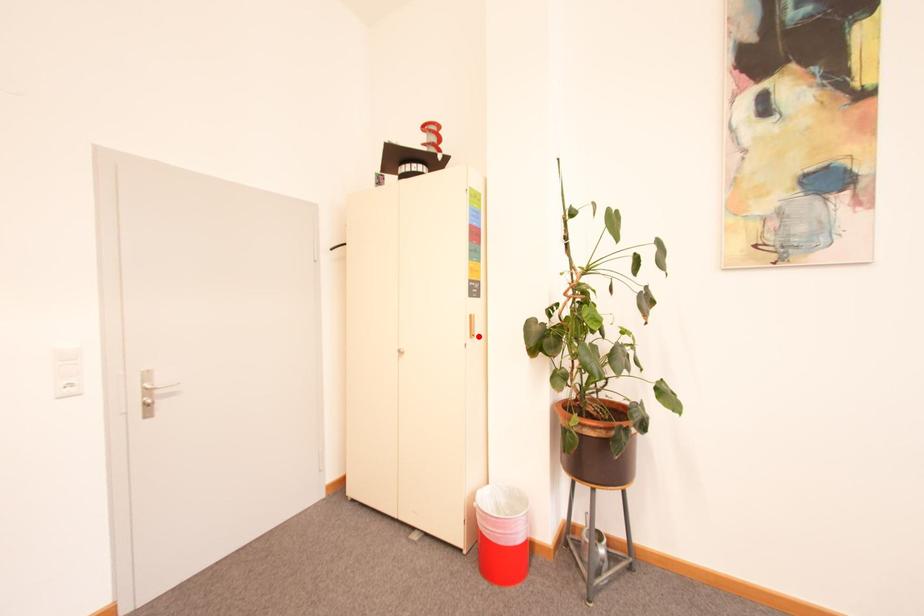
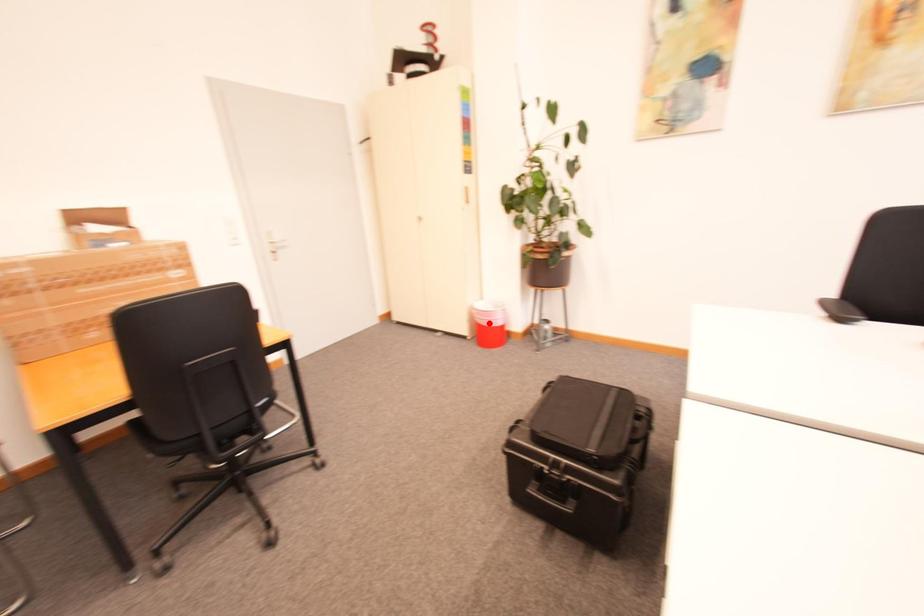
I am providing you with two images of the same scene from different viewpoints. A red point is marked on the first image and another point is marked on the second image. Does the point marked in image1 correspond to the same location as the one in image2?

No